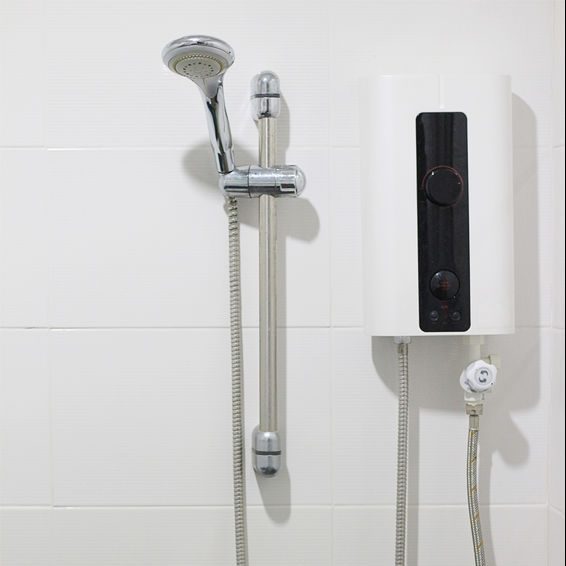
At what (x,y) coordinates should I click in order to perform the action: click on knob to turn. Please return your answer as a coordinate pair (x, y). Image resolution: width=566 pixels, height=566 pixels. Looking at the image, I should click on (492, 372).